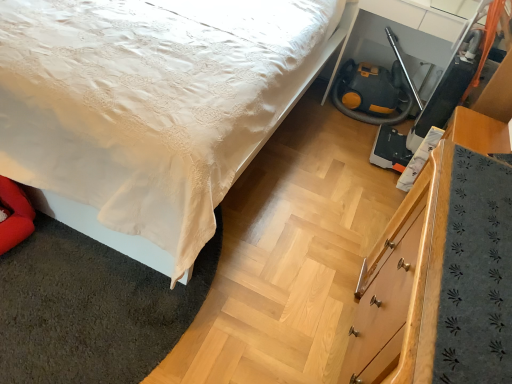
Question: Is white satin bedspread at lower left to the left or to the right of white satin bed at center in the image?

Choices:
 (A) right
 (B) left

Answer: (A)

Question: Would you say white satin bedspread at lower left is inside or outside white satin bed at center?

Choices:
 (A) inside
 (B) outside

Answer: (B)

Question: Which of these objects is positioned closest to the wooden chest of drawers at lower right?

Choices:
 (A) white satin bed at center
 (B) yellow rubber fire hose at lower right
 (C) white satin bedspread at lower left

Answer: (C)

Question: Which is nearer to the white satin bedspread at lower left?

Choices:
 (A) yellow rubber fire hose at lower right
 (B) white satin bed at center
 (C) wooden chest of drawers at lower right

Answer: (B)